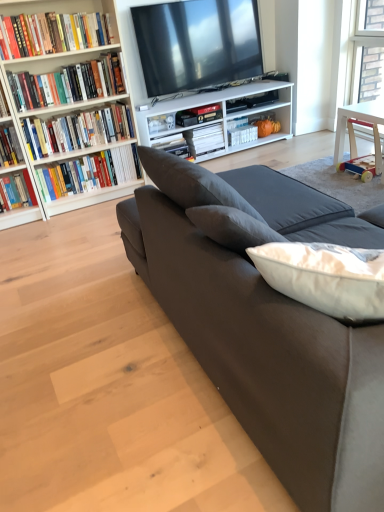
Locate an element on the screen. The image size is (384, 512). free space above hardcover book at left, positioned as the fifth book in front-to-back order (from a real-world perspective) is located at coordinates (79, 154).